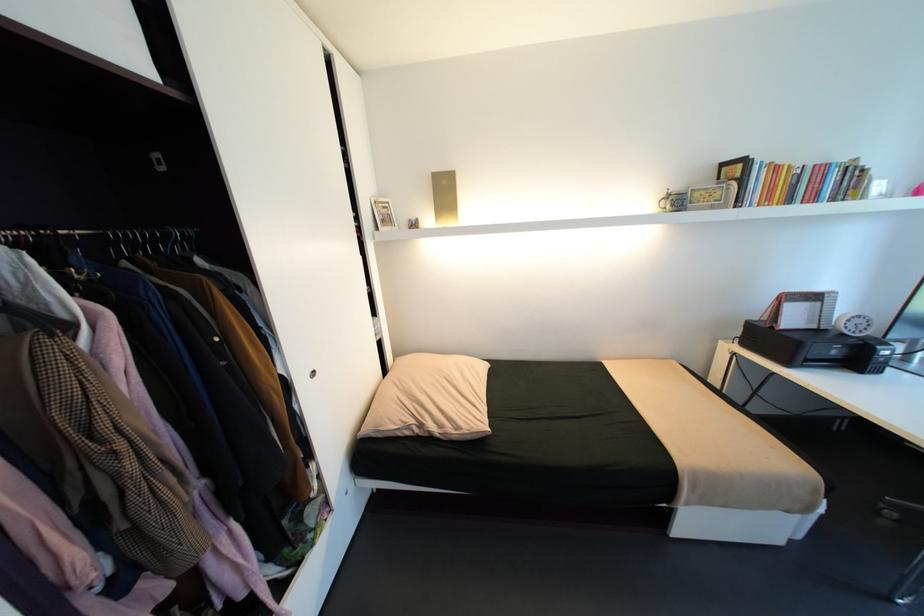
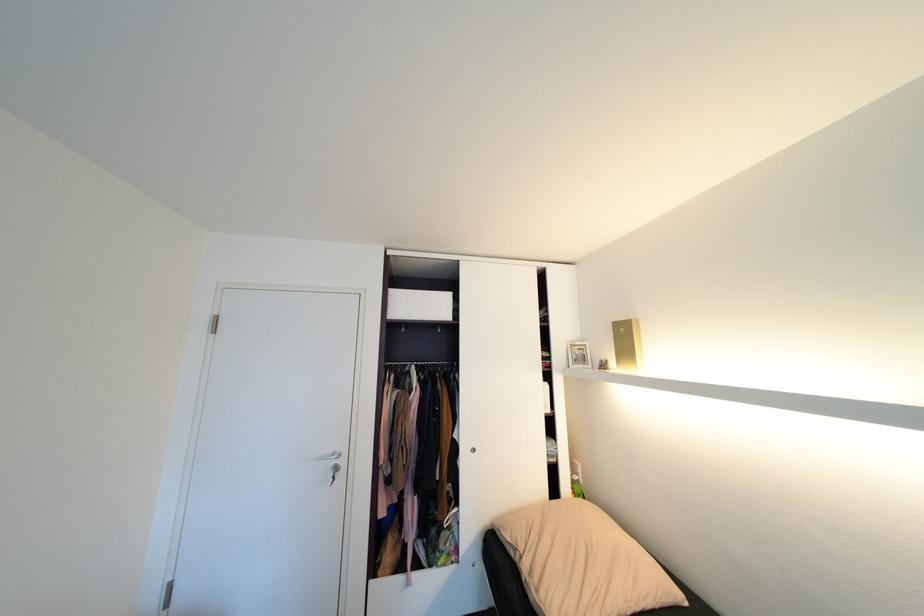
In the second image, find the point that corresponds to point 392,208 in the first image.

(587, 350)